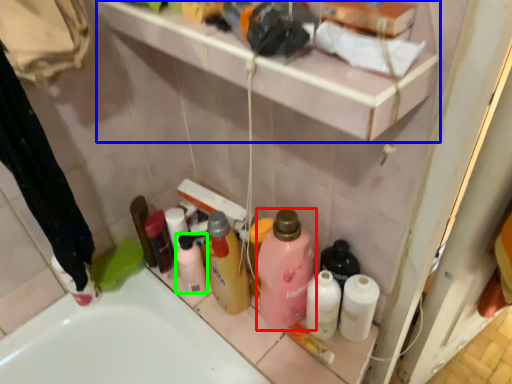
Question: Based on their relative distances, which object is nearer to cleaning product (highlighted by a red box)? Choose from shelf (highlighted by a blue box) and toiletry (highlighted by a green box).

Choices:
 (A) shelf
 (B) toiletry

Answer: (B)